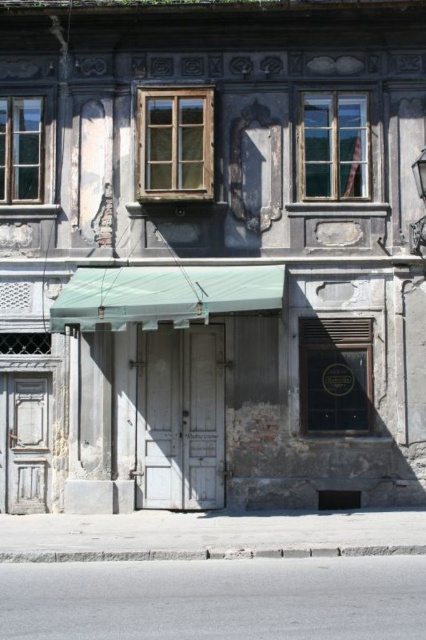
You are standing in front of the old building and want to hang a small flowerpot. The flowerpot requires at least 1 meter of vertical space to be placed safely. Given the green fabric awning at center and the gray concrete curb at lower center, which object provides enough vertical space?

The green fabric awning at center has a greater height compared to the gray concrete curb at lower center, so it provides enough vertical space for the flowerpot.

You are standing on the sidewalk in front of the old building and want to take a photo of the green fabric awning at center and the gray concrete curb at lower center. Which object will appear larger in your photo?

The green fabric awning at center will appear larger in the photo because it is closer to the viewer than the gray concrete curb at lower center.

You are a delivery person trying to park your bike near the gray concrete curb at lower center. However, there is a green fabric awning at center above it. Will the awning interfere with parking your bike there?

The green fabric awning at center is positioned over the gray concrete curb at lower center, so the awning may interfere with parking the bike there depending on its height and the bike dimensions.